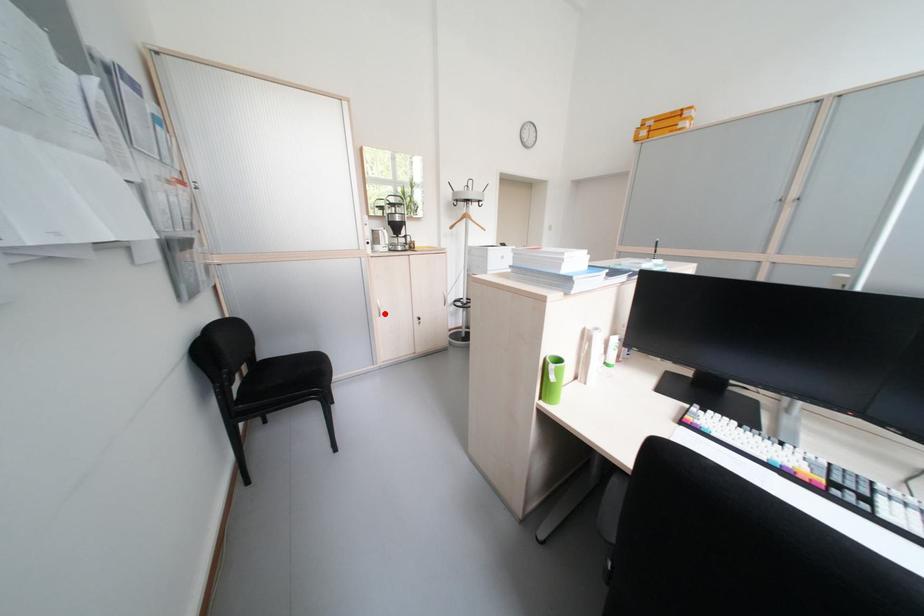
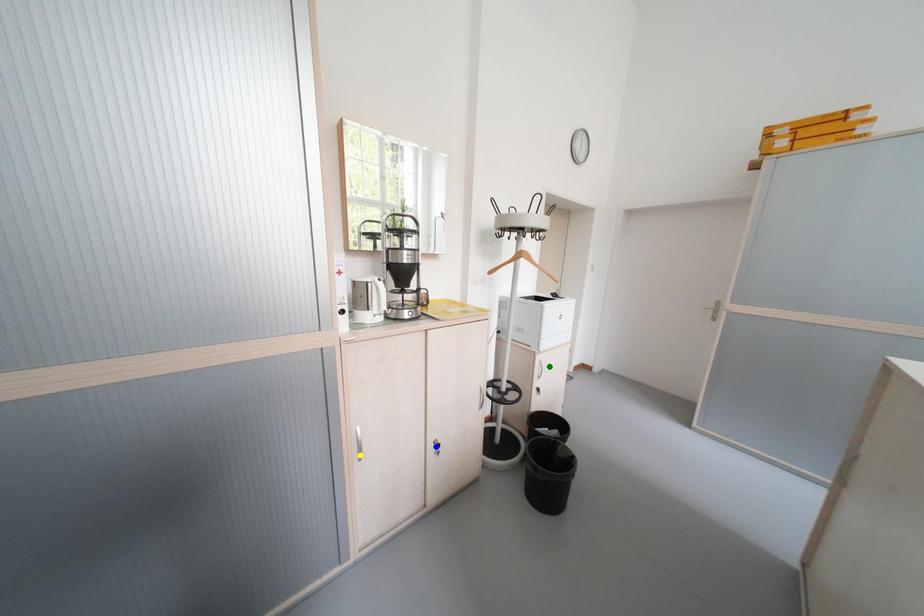
Question: I am providing you with two images of the same scene from different viewpoints. A red point is marked on the first image. You are given multiple points on the second image. Can you choose the point in image 2 that corresponds to the point in image 1?

Choices:
 (A) yellow point
 (B) blue point
 (C) green point

Answer: (A)